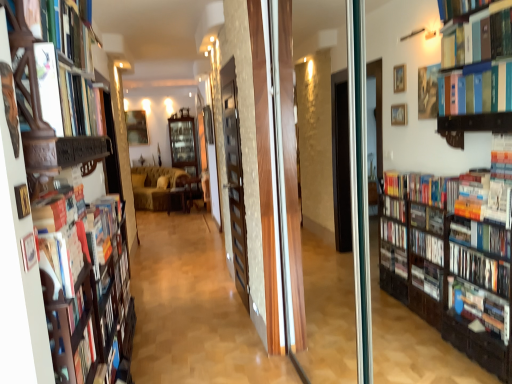
Question: Which direction should I rotate to look at wooden chair at center, which is counted as the 1th furniture, starting from the right, — up or down?

Choices:
 (A) up
 (B) down

Answer: (B)

Question: From the image's perspective, is wooden cabinet at center, which is the 2th shelf in right-to-left order, beneath wooden screen door at center?

Choices:
 (A) yes
 (B) no

Answer: (B)

Question: Can you confirm if wooden cabinet at center, which is the 2th shelf in right-to-left order, is positioned to the right of wooden screen door at center?

Choices:
 (A) yes
 (B) no

Answer: (B)

Question: Does wooden cabinet at center, which is the 2th shelf in right-to-left order, have a greater height compared to wooden screen door at center?

Choices:
 (A) yes
 (B) no

Answer: (B)

Question: Does wooden cabinet at center, which is the 2th shelf in right-to-left order, have a greater width compared to wooden screen door at center?

Choices:
 (A) yes
 (B) no

Answer: (A)

Question: Does wooden cabinet at center, acting as the 1th shelf starting from the back, have a lesser height compared to wooden screen door at center?

Choices:
 (A) no
 (B) yes

Answer: (B)

Question: Is wooden cabinet at center, which is the 2th shelf from front to back, located outside wooden screen door at center?

Choices:
 (A) no
 (B) yes

Answer: (B)

Question: Would you say wooden bookshelf at left, which is the 1th shelf in right-to-left order, contains hardcover book at upper left, the first book viewed from the front?

Choices:
 (A) yes
 (B) no

Answer: (A)

Question: Is wooden bookshelf at left, the first shelf when ordered from front to back, positioned before hardcover book at upper left, which ranks as the 2th book in bottom-to-top order?

Choices:
 (A) no
 (B) yes

Answer: (B)

Question: From a real-world perspective, is wooden bookshelf at left, the 2th shelf in the left-to-right sequence, on top of hardcover book at upper left, which ranks as the 1th book in top-to-bottom order?

Choices:
 (A) yes
 (B) no

Answer: (B)

Question: Is wooden bookshelf at left, the first shelf when ordered from front to back, thinner than hardcover book at upper left, the second book when ordered from back to front?

Choices:
 (A) yes
 (B) no

Answer: (B)

Question: Is wooden bookshelf at left, the 2th shelf in the left-to-right sequence, placed right next to hardcover book at upper left, the second book when ordered from back to front?

Choices:
 (A) no
 (B) yes

Answer: (A)

Question: Is hardcover book at upper left, the first book viewed from the front, at the back of wooden bookshelf at left, the 2th shelf positioned from the back?

Choices:
 (A) yes
 (B) no

Answer: (A)

Question: Does wooden chair at center, which is counted as the 1th furniture, starting from the right, have a lesser height compared to wooden cabinet at center, which is the 2th shelf in right-to-left order?

Choices:
 (A) yes
 (B) no

Answer: (A)